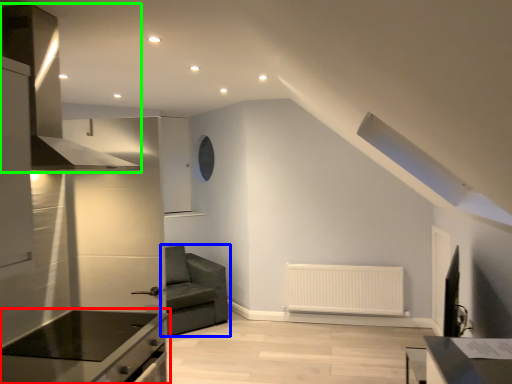
Question: Estimate the real-world distances between objects in this image. Which object is closer to countertop (highlighted by a red box), studio couch (highlighted by a blue box) or exhaust hood (highlighted by a green box)?

Choices:
 (A) studio couch
 (B) exhaust hood

Answer: (B)